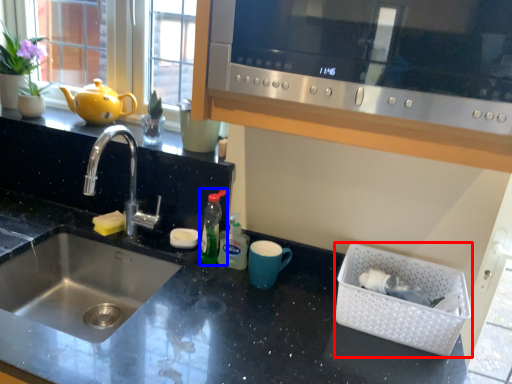
Question: Among these objects, which one is nearest to the camera, basket (highlighted by a red box) or bottle (highlighted by a blue box)?

Choices:
 (A) basket
 (B) bottle

Answer: (A)